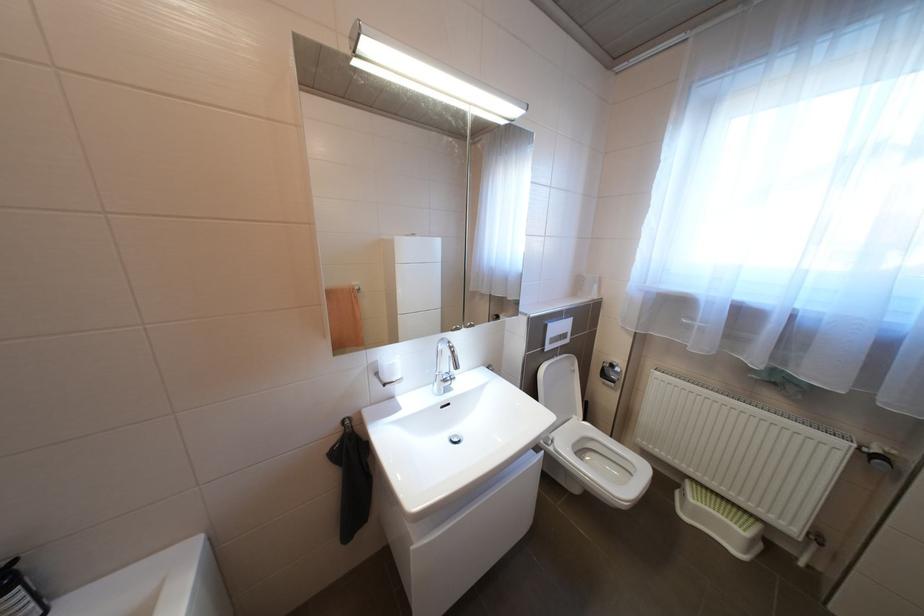
Where would you lift the chrome faucet handle? Please return your answer as a coordinate pair (x, y).

(445, 355)